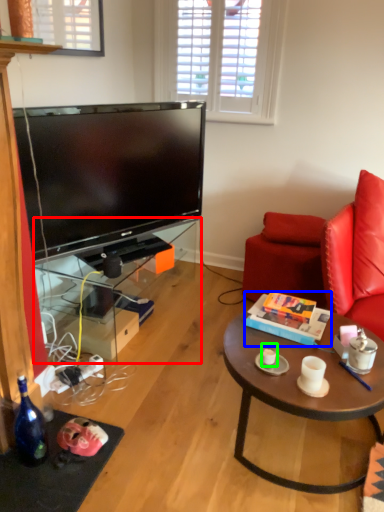
Question: Estimate the real-world distances between objects in this image. Which object is closer to desk (highlighted by a red box), box (highlighted by a blue box) or coffee cup (highlighted by a green box)?

Choices:
 (A) box
 (B) coffee cup

Answer: (A)